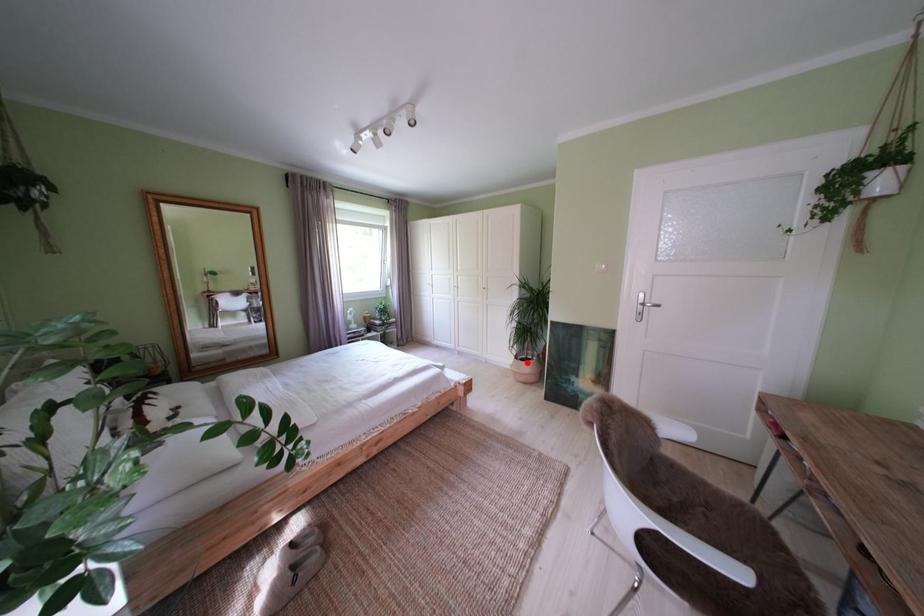
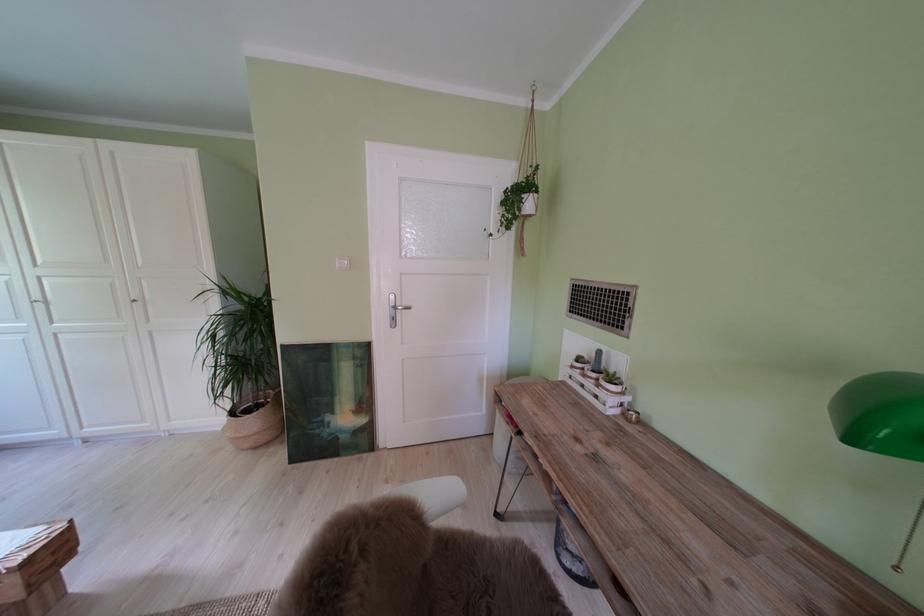
Question: I am providing you with two images of the same scene from different viewpoints. In image1, a red point is highlighted. Considering the same 3D point in image2, which of the following is correct?

Choices:
 (A) It is closer
 (B) It is farther

Answer: (A)